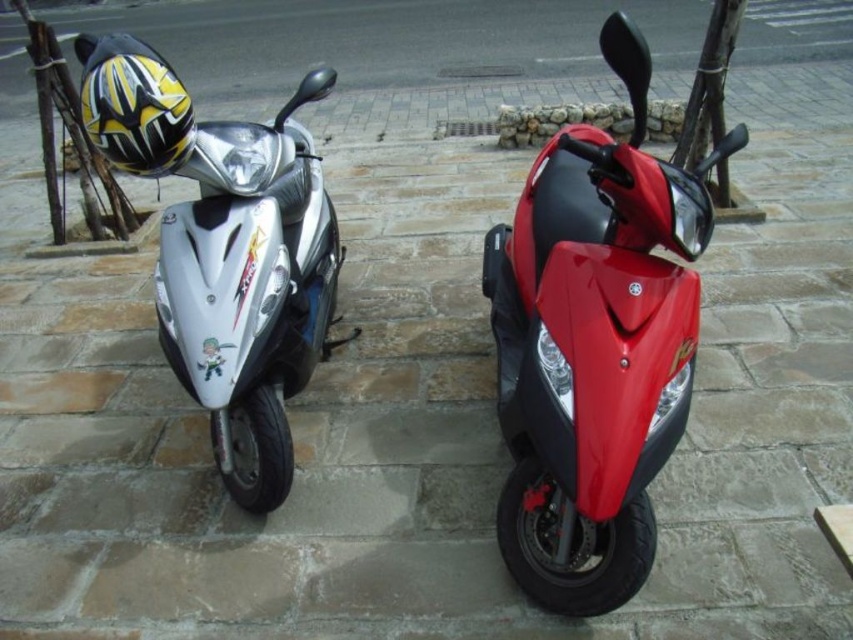
Does shiny red scooter at center have a smaller size compared to shiny silver scooter at left?

Yes, shiny red scooter at center is smaller than shiny silver scooter at left.

Does shiny red scooter at center have a lesser height compared to shiny silver scooter at left?

Correct, shiny red scooter at center is not as tall as shiny silver scooter at left.

Measure the distance between shiny red scooter at center and camera.

shiny red scooter at center is 1.29 meters from camera.

The image size is (853, 640). I want to click on shiny red scooter at center, so click(596, 339).